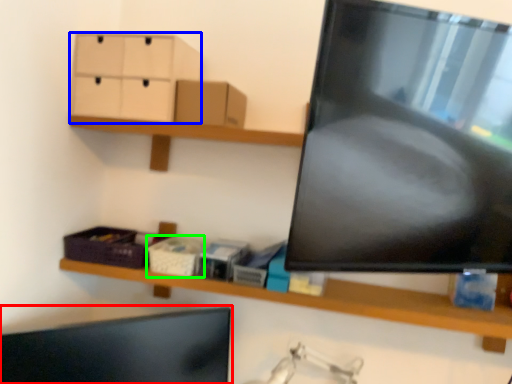
Question: Estimate the real-world distances between objects in this image. Which object is closer to computer monitor (highlighted by a red box), drawer (highlighted by a blue box) or storage box (highlighted by a green box)?

Choices:
 (A) drawer
 (B) storage box

Answer: (B)